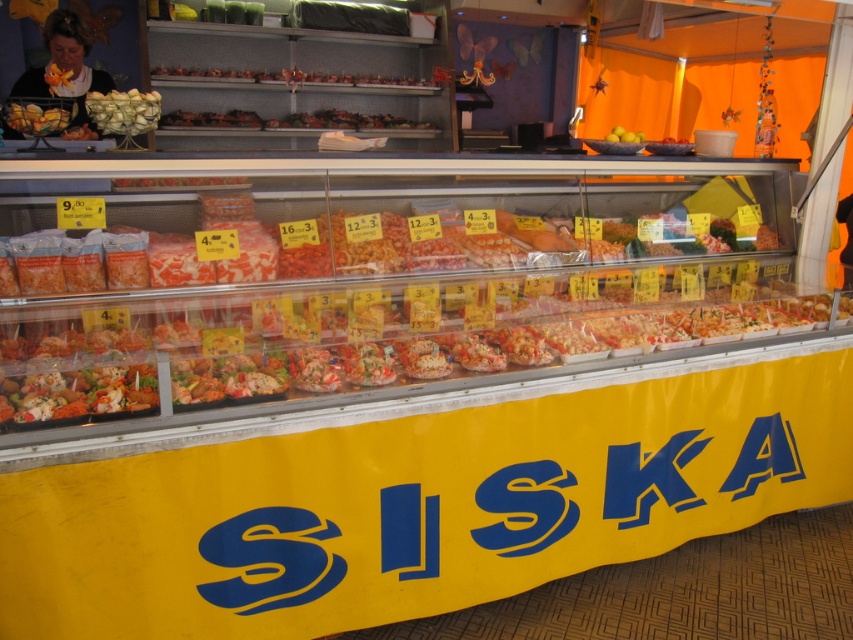
Question: Estimate the real-world distances between objects in this image. Which object is closer to the shiny plastic salad at lower left?

Choices:
 (A) translucent plastic bag at upper center
 (B) matte plastic bag at upper left
 (C) yellow matte lemons at upper right
 (D) matte yellow fruit at upper left

Answer: (D)

Question: Does green matte vegetables at upper left come in front of translucent plastic bag at upper center?

Choices:
 (A) yes
 (B) no

Answer: (A)

Question: Which point appears farthest from the camera in this image?

Choices:
 (A) (607, 134)
 (B) (64, 129)
 (C) (12, 109)

Answer: (A)

Question: Is translucent plastic bag at upper center closer to camera compared to yellow matte lemons at upper right?

Choices:
 (A) no
 (B) yes

Answer: (A)

Question: Which point is closer to the camera?

Choices:
 (A) (190, 76)
 (B) (619, 140)
 (C) (125, 125)

Answer: (C)

Question: Does shiny plastic salad at lower left appear over translucent plastic bag at upper center?

Choices:
 (A) no
 (B) yes

Answer: (A)